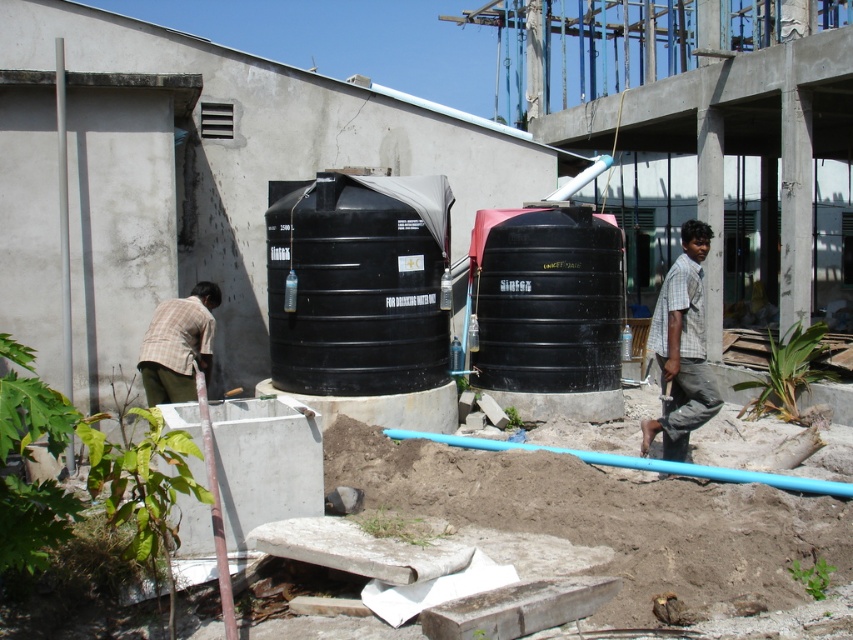
Is point (318, 227) less distant than point (585, 220)?

Yes, point (318, 227) is in front of point (585, 220).

Is black matte water tank at center shorter than black matte tank at center?

In fact, black matte water tank at center may be taller than black matte tank at center.

I want to click on black matte water tank at center, so click(x=357, y=288).

Which of these two, black matte water tank at center or gray checkered shirt at right, stands shorter?

gray checkered shirt at right is shorter.

Who is positioned more to the left, black matte water tank at center or gray checkered shirt at right?

black matte water tank at center is more to the left.

This screenshot has height=640, width=853. What do you see at coordinates (357, 288) in the screenshot?
I see `black matte water tank at center` at bounding box center [357, 288].

Find the location of a particular element. black matte water tank at center is located at coordinates (357, 288).

Who is lower down, gray checkered shirt at right or plaid shirt at left?

Positioned lower is gray checkered shirt at right.

Between point (677, 380) and point (183, 401), which one is positioned in front?

Positioned in front is point (677, 380).

You are a GUI agent. You are given a task and a screenshot of the screen. Output one action in this format:
    pyautogui.click(x=<x>, y=<y>)
    Task: Click on the gray checkered shirt at right
    
    Given the screenshot: What is the action you would take?
    pyautogui.click(x=682, y=348)